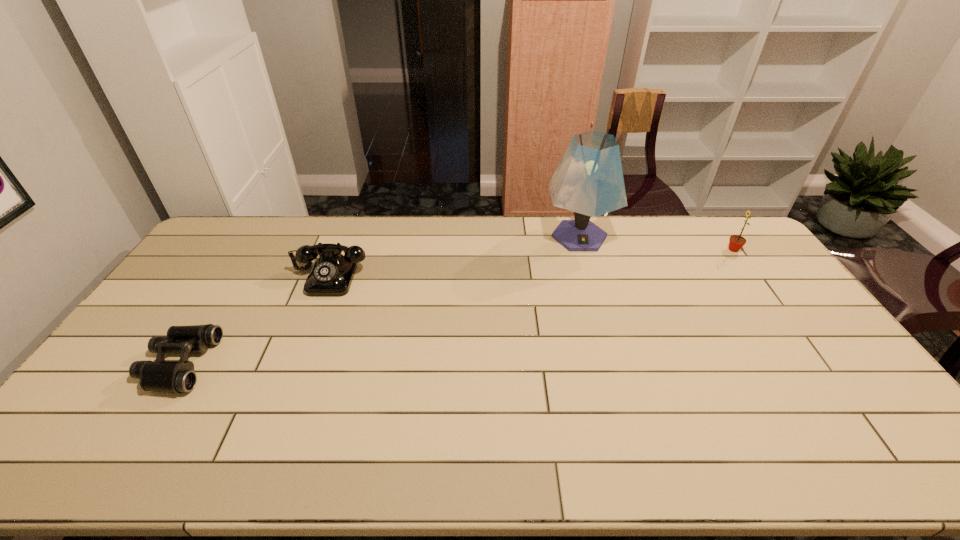
Image resolution: width=960 pixels, height=540 pixels. What are the coordinates of `vacant area that lies between the binoculars and the second tallest object` in the screenshot? It's located at (456, 307).

Find the location of a particular element. vacant space in between the third tallest object and the lampshade is located at coordinates (454, 256).

This screenshot has width=960, height=540. What are the coordinates of `free space between the rightmost object and the third object from left to right` in the screenshot? It's located at (657, 244).

Where is `object that is the closest to the rightmost object`? object that is the closest to the rightmost object is located at coordinates (589, 181).

Identify which object is the second closest to the third object from right to left. Please provide its 2D coordinates. Your answer should be formatted as a tuple, i.e. [(x, y)], where the tuple contains the x and y coordinates of a point satisfying the conditions above.

[(589, 181)]

Locate an element on the screen. vacant region that satisfies the following two spatial constraints: 1. on the dial of the third object from right to left; 2. on the front-facing side of the nearest object is located at coordinates (296, 363).

The image size is (960, 540). Identify the location of vacant position in the image that satisfies the following two spatial constraints: 1. on the base of the lampshade; 2. on the front-facing side of the shortest object. (615, 363).

This screenshot has width=960, height=540. I want to click on free point that satisfies the following two spatial constraints: 1. on the base of the third object from left to right; 2. on the front-facing side of the shortest object, so pyautogui.click(x=615, y=363).

Find the location of a particular element. free space that satisfies the following two spatial constraints: 1. on the dial of the telephone; 2. on the front-facing side of the shortest object is located at coordinates (296, 363).

Find the location of `free point that satisfies the following two spatial constraints: 1. on the face of the rightmost object; 2. on the dial of the third object from right to left`. free point that satisfies the following two spatial constraints: 1. on the face of the rightmost object; 2. on the dial of the third object from right to left is located at coordinates (753, 276).